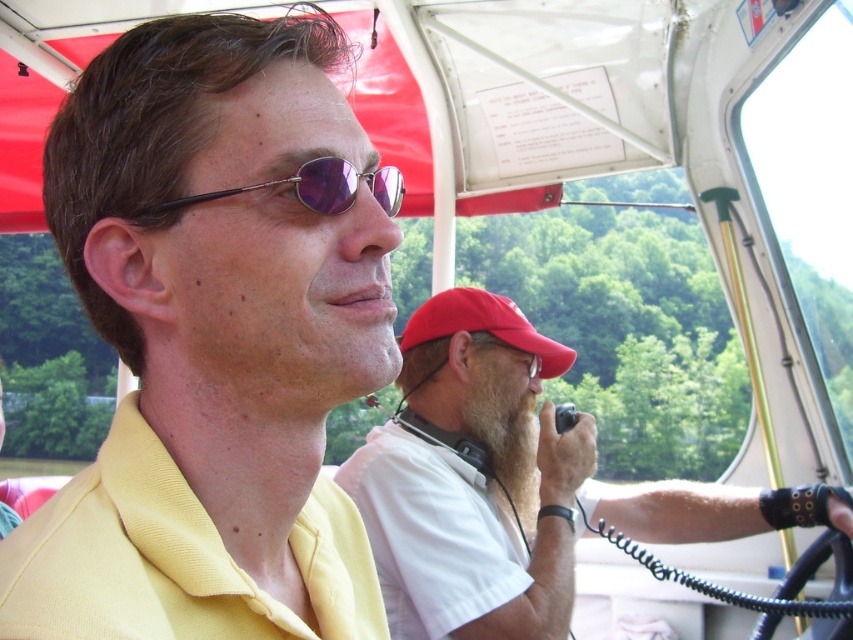
You are a passenger in the aircraft and want to ask the pilot for directions. Which object, the white matte shirt at center or the metallic purple sunglasses at center, is closer to your left side?

The metallic purple sunglasses at center is closer to your left side because the white matte shirt at center is positioned to the right of it.

You are a passenger in the aircraft and want to know which of the two points, point (489, 593) or point (337, 204), is closer to you. Can you determine this based on their positions?

Point (489, 593) is further to the viewer than point (337, 204), so point (337, 204) is closer to you.

You are a pilot preparing to adjust the cockpit controls. You need to place a small tool between the red fabric baseball cap at upper right and the metallic purple sunglasses at center. Is there enough space between them for the tool?

The red fabric baseball cap at upper right might be wider than metallic purple sunglasses at center, so there may not be enough space between them for the tool.